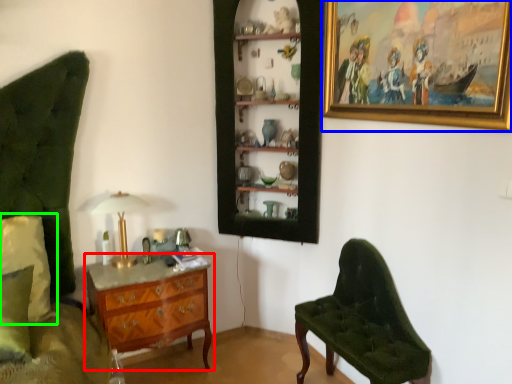
Question: Estimate the real-world distances between objects in this image. Which object is closer to chest of drawers (highlighted by a red box), picture frame (highlighted by a blue box) or pillow (highlighted by a green box)?

Choices:
 (A) picture frame
 (B) pillow

Answer: (B)